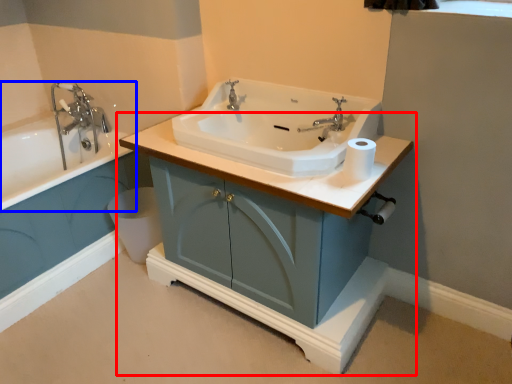
Question: Which object appears closest to the camera in this image, bathroom cabinet (highlighted by a red box) or bathtub (highlighted by a blue box)?

Choices:
 (A) bathroom cabinet
 (B) bathtub

Answer: (A)